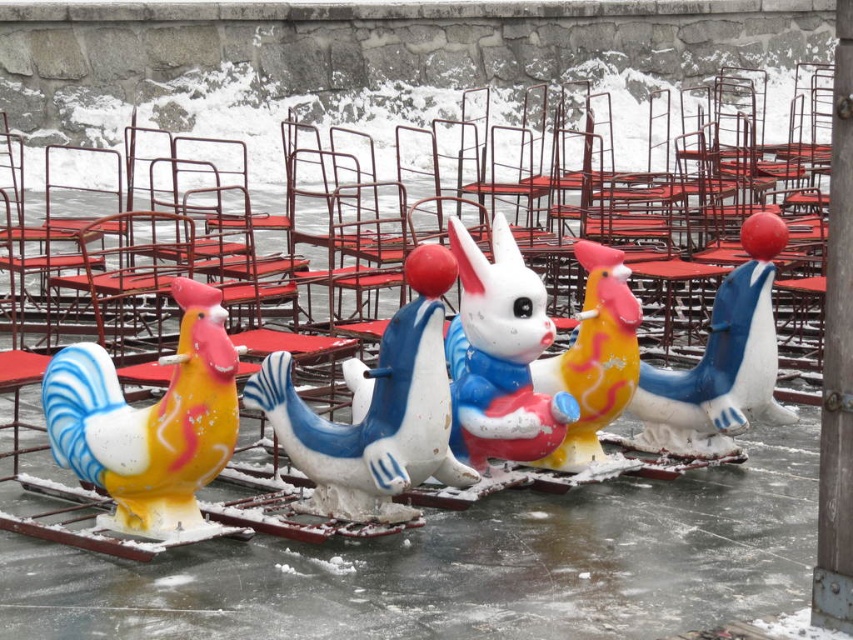
You are standing at the position of the point with coordinates point (x=212, y=349) and want to move towards the point (x=589, y=316). According to the scene, will you be moving towards the background or the foreground?

Since point (x=212, y=349) is in front of point (x=589, y=316), moving from point (x=212, y=349) towards point (x=589, y=316) means you are moving towards the background.